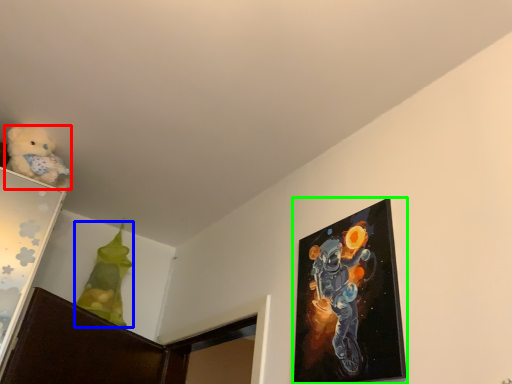
Question: Estimate the real-world distances between objects in this image. Which object is farther from teddy bear (highlighted by a red box), toy (highlighted by a blue box) or picture frame (highlighted by a green box)?

Choices:
 (A) toy
 (B) picture frame

Answer: (B)